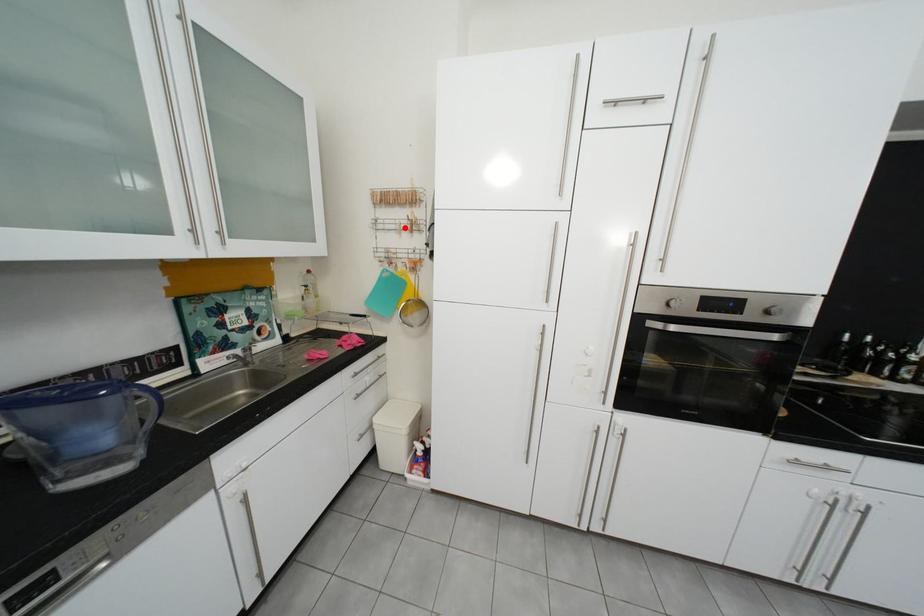
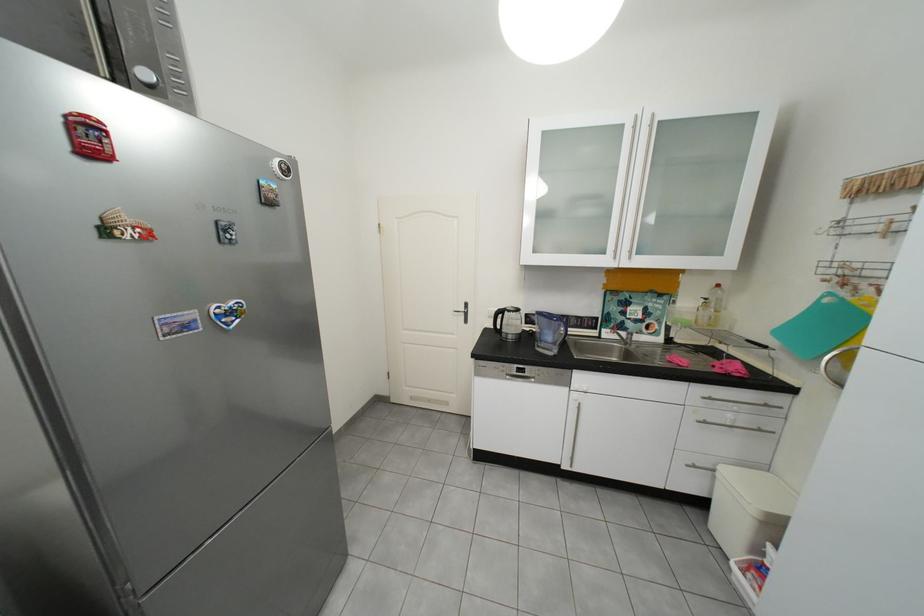
In the second image, find the point that corresponds to the highlighted location in the first image.

(881, 230)